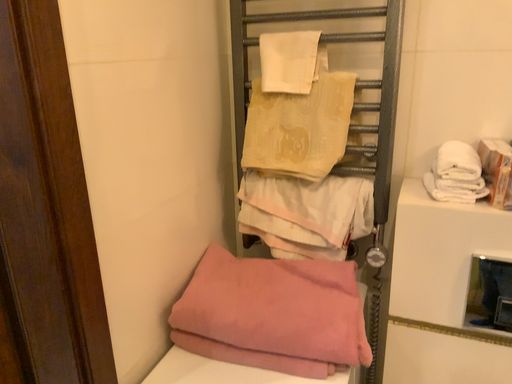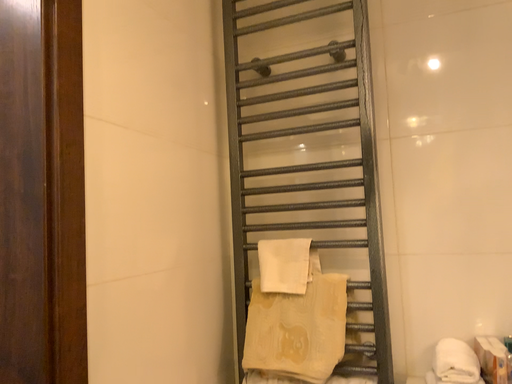
Question: Which way did the camera rotate in the video?

Choices:
 (A) rotated upward
 (B) rotated downward

Answer: (A)